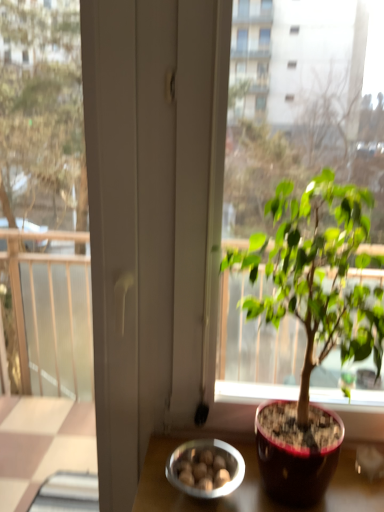
Question: Do you think green glossy houseplant at center is within metallic silver bowl at lower center, or outside of it?

Choices:
 (A) outside
 (B) inside

Answer: (A)

Question: Is green glossy houseplant at center wider or thinner than metallic silver bowl at lower center?

Choices:
 (A) wide
 (B) thin

Answer: (A)

Question: Based on their sizes in the image, would you say green glossy houseplant at center is bigger or smaller than metallic silver bowl at lower center?

Choices:
 (A) big
 (B) small

Answer: (A)

Question: Is metallic silver bowl at lower center inside or outside of green glossy houseplant at center?

Choices:
 (A) inside
 (B) outside

Answer: (A)

Question: In the image, is metallic silver bowl at lower center on the left side or the right side of green glossy houseplant at center?

Choices:
 (A) right
 (B) left

Answer: (B)

Question: Is metallic silver bowl at lower center in front of or behind green glossy houseplant at center in the image?

Choices:
 (A) front
 (B) behind

Answer: (B)

Question: From the image's perspective, is metallic silver bowl at lower center positioned above or below green glossy houseplant at center?

Choices:
 (A) above
 (B) below

Answer: (B)